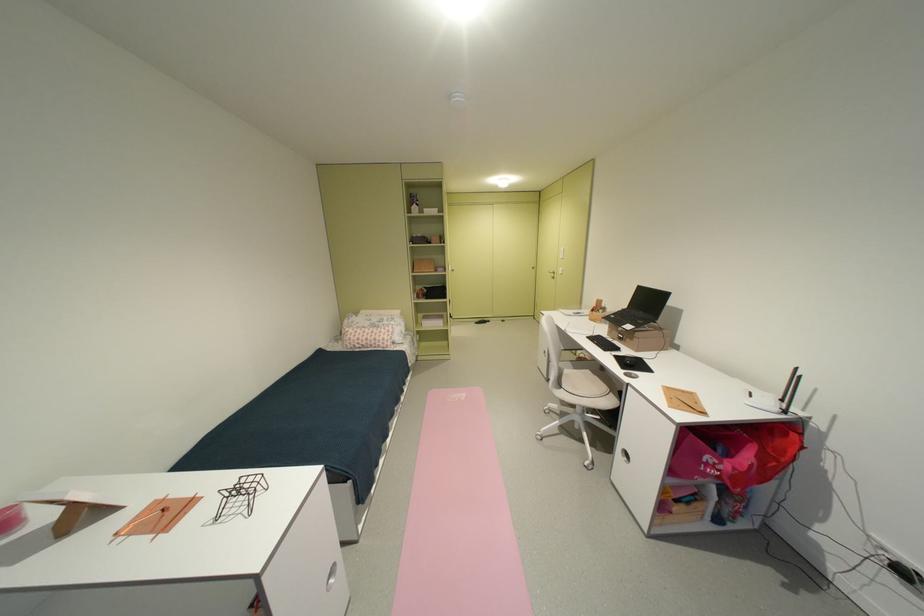
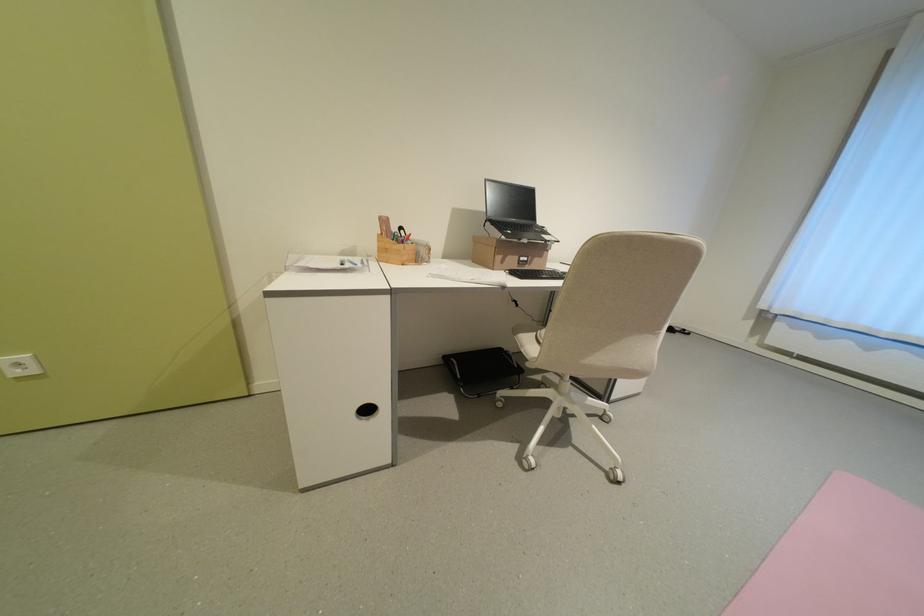
Find the pixel in the second image that matches (630,338) in the first image.

(536, 261)